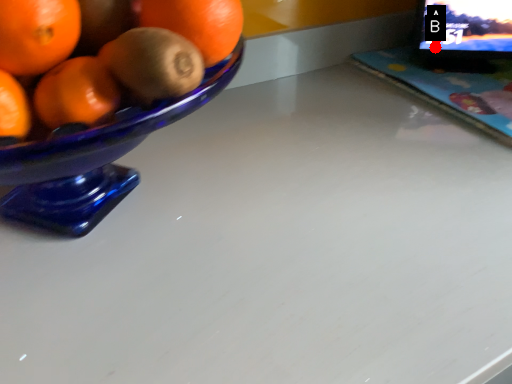
Question: Two points are circled on the image, labeled by A and B beside each circle. Among these points, which one is nearest to the camera?

Choices:
 (A) A is closer
 (B) B is closer

Answer: (A)